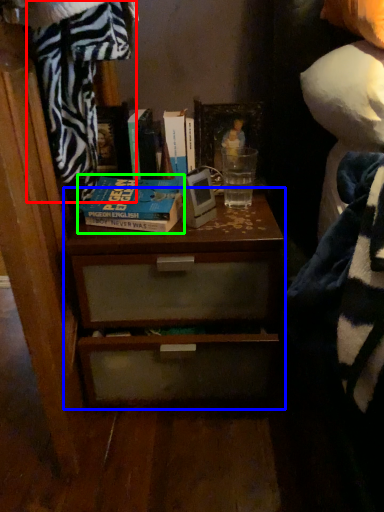
Question: Which object is the closest to the blanket (highlighted by a red box)? Choose among these: chest of drawers (highlighted by a blue box) or book (highlighted by a green box).

Choices:
 (A) chest of drawers
 (B) book

Answer: (B)